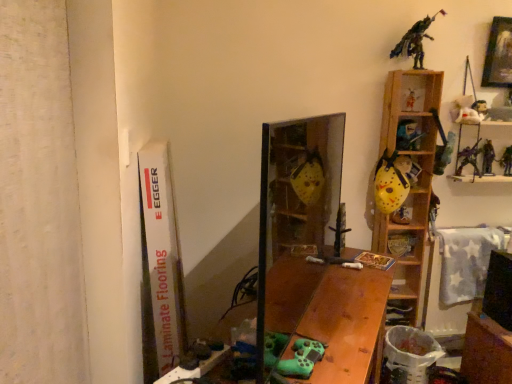
You are a GUI agent. You are given a task and a screenshot of the screen. Output one action in this format:
    pyautogui.click(x=<x>, y=<y>)
    Task: Click on the free spot to the right of green matte controller at lower center, arranged as the 12th toy when viewed from the right
    
    Given the screenshot: What is the action you would take?
    pyautogui.click(x=345, y=359)